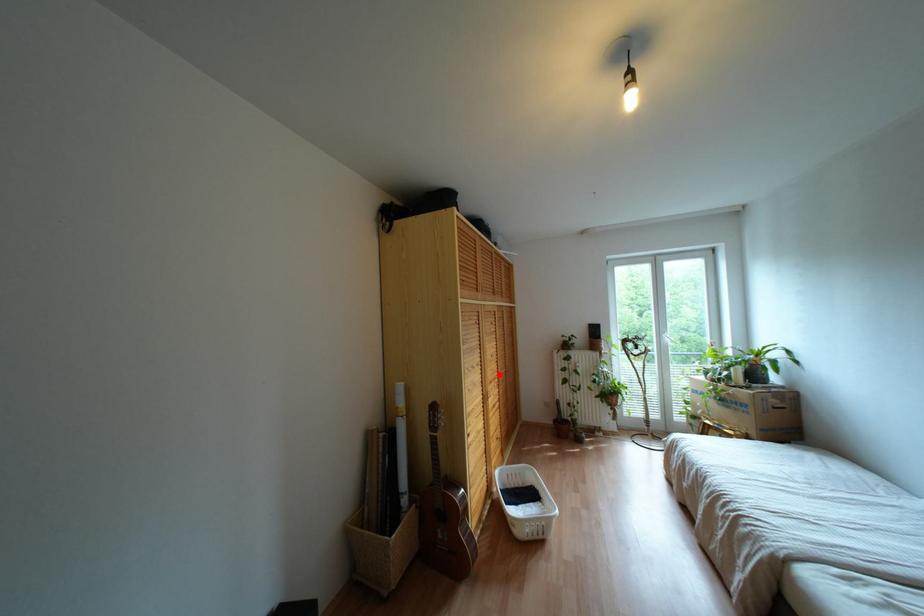
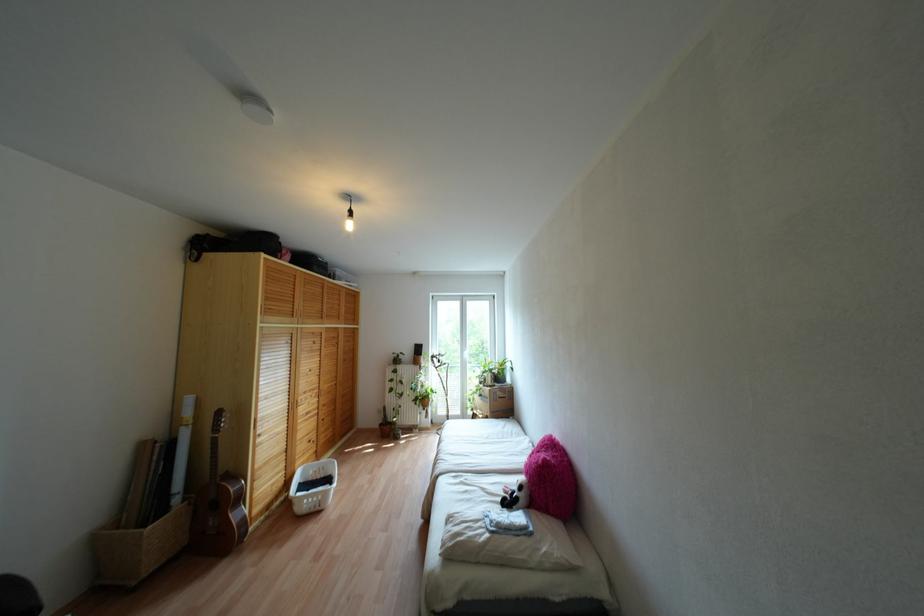
Question: I am providing you with two images of the same scene from different viewpoints. Given a red point in image1, look at the same physical point in image2. Is it:

Choices:
 (A) Closer to the viewpoint
 (B) Farther from the viewpoint

Answer: (A)